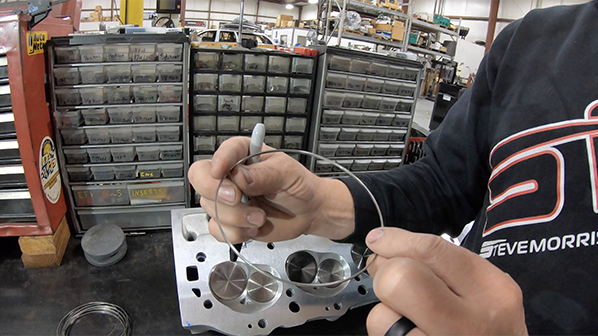
This screenshot has width=598, height=336. What are the coordinates of `large item shelf` in the screenshot? It's located at (388, 27).